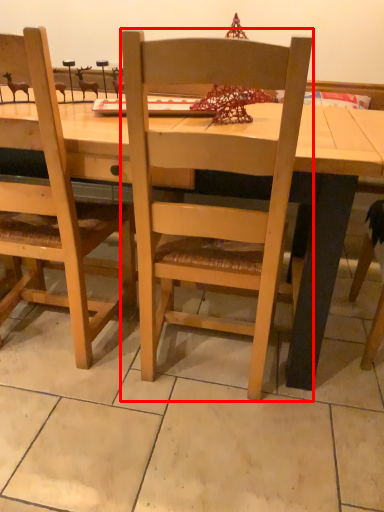
Question: Where is chair (annotated by the red box) located in relation to desk in the image?

Choices:
 (A) left
 (B) right

Answer: (B)